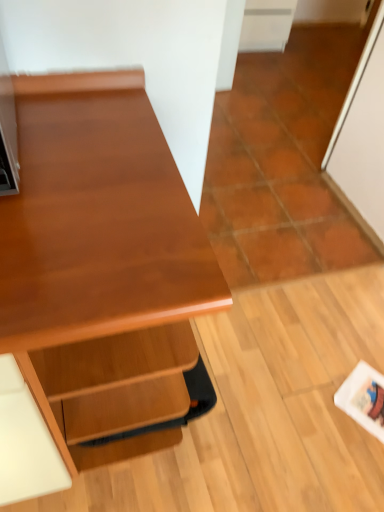
In order to click on wooden desk at center in this screenshot , I will do `click(100, 259)`.

Describe the element at coordinates (100, 259) in the screenshot. I see `wooden desk at center` at that location.

Where is `wooden desk at center`? This screenshot has height=512, width=384. wooden desk at center is located at coordinates (100, 259).